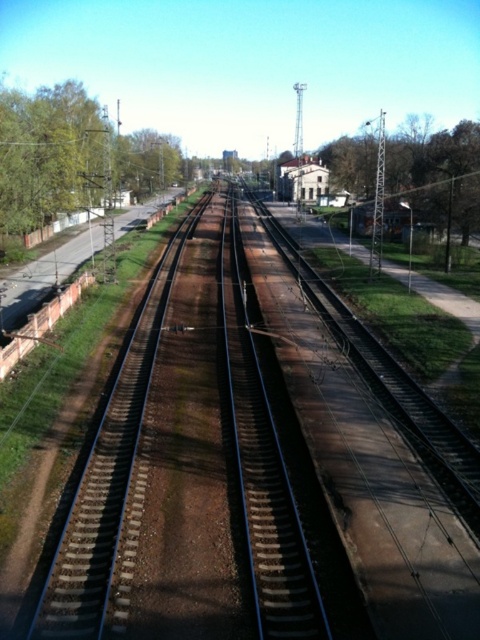
You are a landscape architect analyzing the railway scene. You need to determine which tree has a wider canopy between the green leafy tree at left and the green leafy tree at center. Which one should you choose?

The green leafy tree at center has a wider canopy than the green leafy tree at left, so you should choose the green leafy tree at center.

You are standing on the bridge looking down at the railway. Which tree is closer to the left side of the bridge, the green leafy tree at left or the green leafy tree at center?

The green leafy tree at left is closer to the left side of the bridge because it is positioned to the left of the green leafy tree at center.